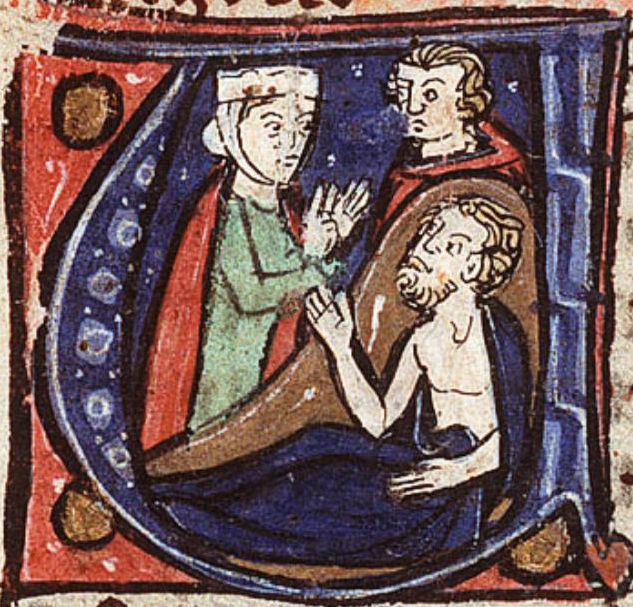
This screenshot has height=607, width=633. Identify the location of robe. (195, 220), (501, 155).